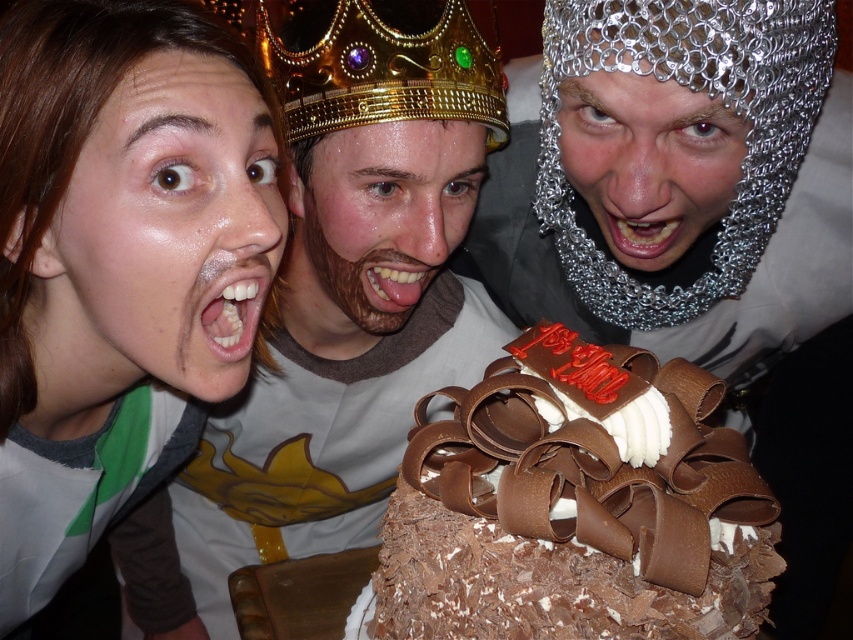
Is satin skin face at upper left wider than chocolatematerial/textureface at center?

Incorrect, satin skin face at upper left's width does not surpass chocolatematerial/textureface at center's.

How far apart are satin skin face at upper left and chocolatematerial/textureface at center?

satin skin face at upper left and chocolatematerial/textureface at center are 9.42 inches apart from each other.

Between point (171, 296) and point (422, 134), which one is positioned behind?

The point (422, 134) is more distant.

The height and width of the screenshot is (640, 853). Find the location of `satin skin face at upper left`. satin skin face at upper left is located at coordinates (160, 240).

In the scene shown: Is satin skin face at upper left below metallic chainmail mouth at center?

Yes.

Measure the distance from satin skin face at upper left to metallic chainmail mouth at center.

satin skin face at upper left and metallic chainmail mouth at center are 17.25 inches apart.

Locate an element on the screen. Image resolution: width=853 pixels, height=640 pixels. satin skin face at upper left is located at coordinates (160, 240).

Which is in front, point (460, 212) or point (653, 250)?

Positioned in front is point (653, 250).

Measure the distance between point [303,307] and camera.

A distance of 3.61 feet exists between point [303,307] and camera.

This screenshot has height=640, width=853. I want to click on chocolatematerial/textureface at center, so click(376, 224).